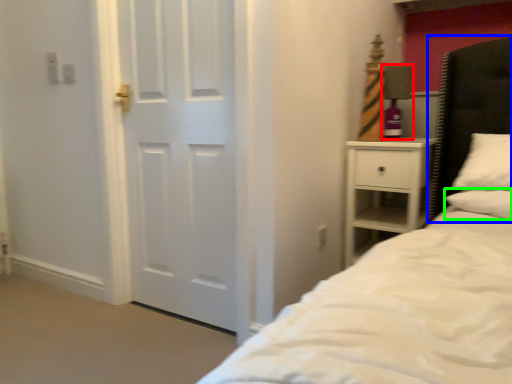
Question: Estimate the real-world distances between objects in this image. Which object is closer to lamp (highlighted by a red box), headboard (highlighted by a blue box) or pillow (highlighted by a green box)?

Choices:
 (A) headboard
 (B) pillow

Answer: (A)